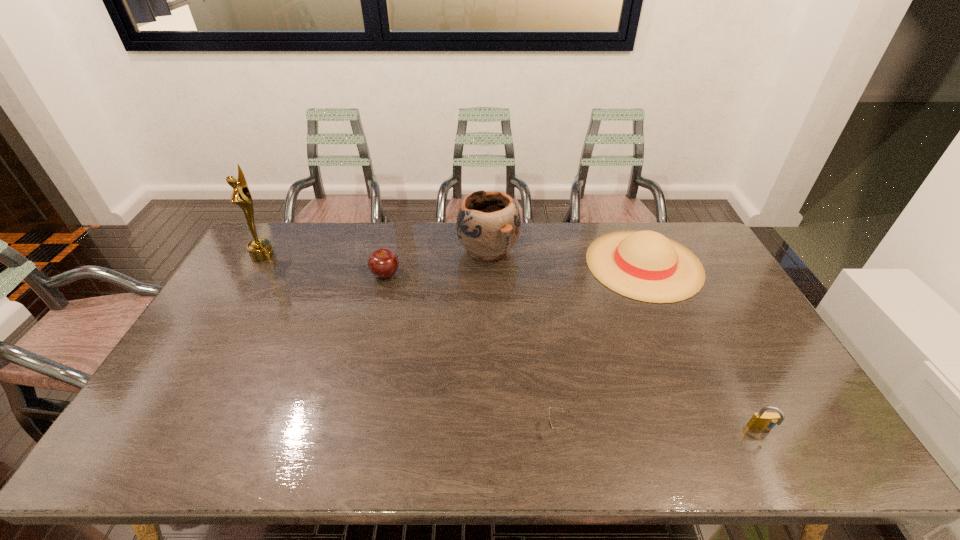
What are the coordinates of `sunglasses located at the near edge` in the screenshot? It's located at (550, 424).

This screenshot has height=540, width=960. In order to click on object that is at the left edge in this screenshot , I will do `click(260, 249)`.

What are the coordinates of `sombrero present at the right edge` in the screenshot? It's located at (645, 265).

You are a GUI agent. You are given a task and a screenshot of the screen. Output one action in this format:
    pyautogui.click(x=<x>, y=<y>)
    Task: Click on the padlock located in the right edge section of the desktop
    
    Given the screenshot: What is the action you would take?
    pyautogui.click(x=763, y=420)

Where is `object that is at the far left corner`? object that is at the far left corner is located at coordinates (260, 249).

Locate an element on the screen. The width and height of the screenshot is (960, 540). object present at the far right corner is located at coordinates (645, 265).

This screenshot has height=540, width=960. I want to click on object that is positioned at the near right corner, so click(763, 420).

Find the location of a particular element. This screenshot has width=960, height=540. vacant region at the far edge of the desktop is located at coordinates (338, 241).

In the image, there is a desktop. In order to click on free region at the near edge in this screenshot , I will do `click(332, 434)`.

At what (x,y) coordinates should I click in order to perform the action: click on free space at the left edge. Please return your answer as a coordinate pair (x, y). Looking at the image, I should click on (247, 276).